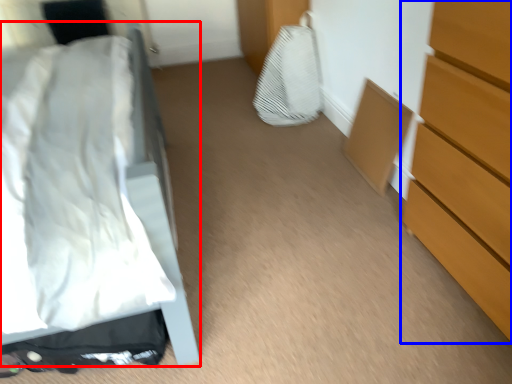
Question: Which point is closer to the camera, bed (highlighted by a red box) or chest of drawers (highlighted by a blue box)?

Choices:
 (A) bed
 (B) chest of drawers

Answer: (A)